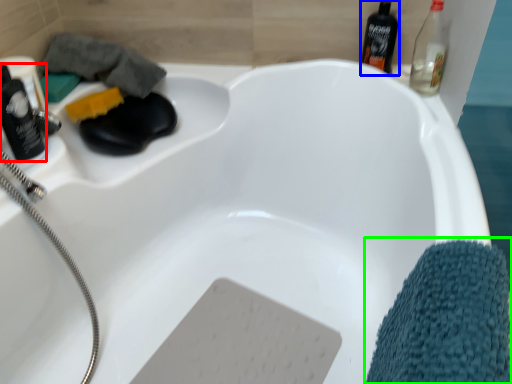
Question: Estimate the real-world distances between objects in this image. Which object is farther from bottle (highlighted by a red box), mouthwash (highlighted by a blue box) or bath towel (highlighted by a green box)?

Choices:
 (A) mouthwash
 (B) bath towel

Answer: (A)